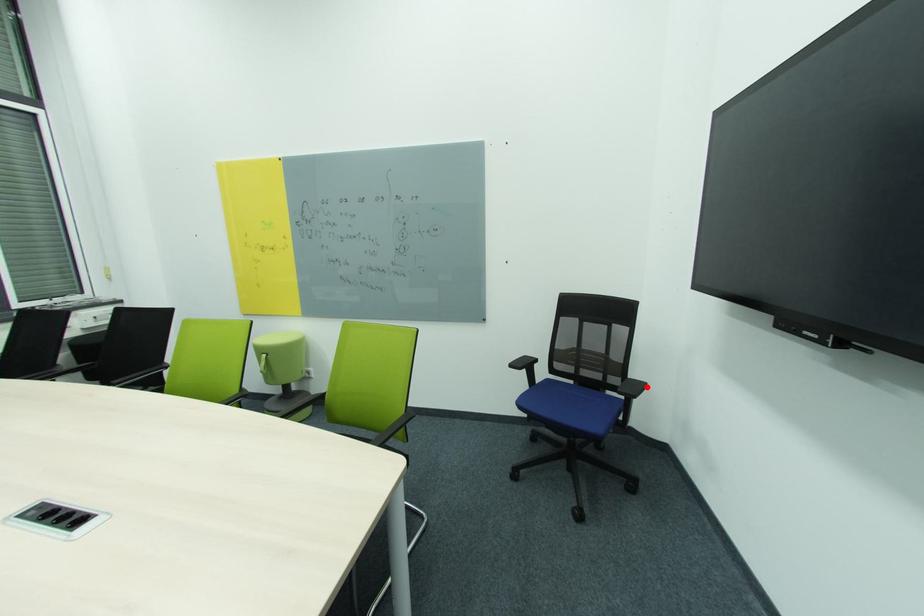
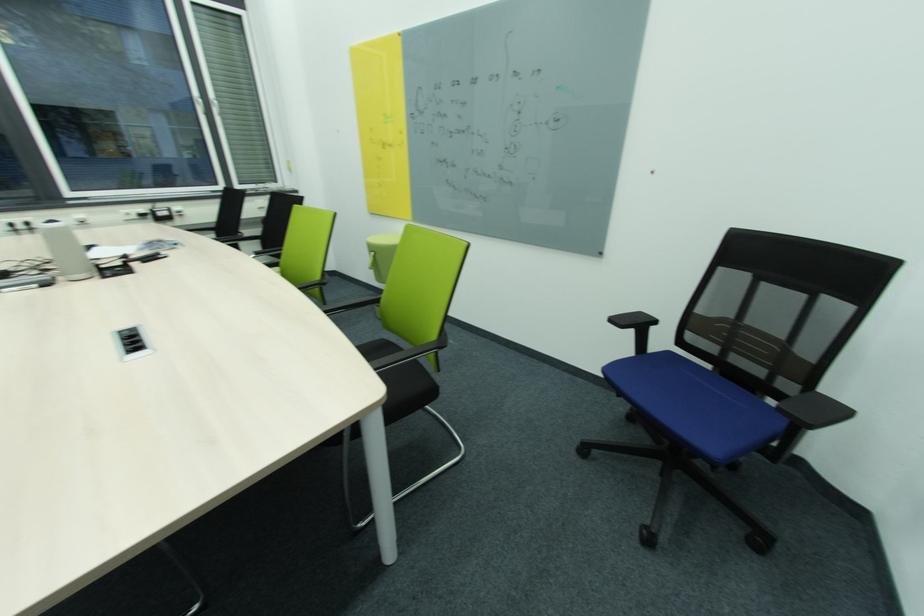
The point at the highlighted location is marked in the first image. Where is the corresponding point in the second image?

(845, 411)